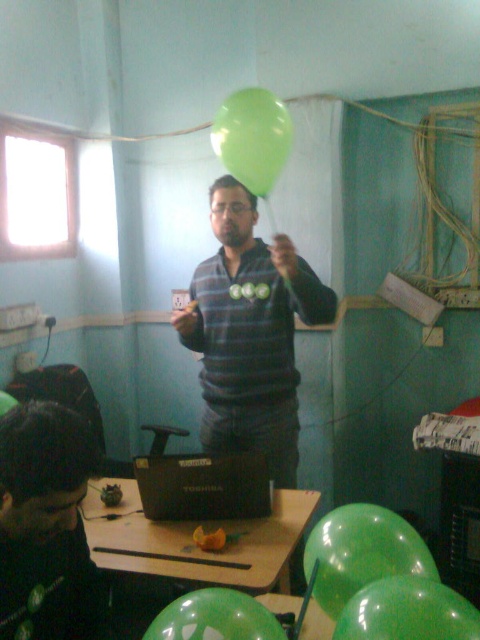
Question: Is matte black laptop at center thinner than green rubber balloon at center?

Choices:
 (A) no
 (B) yes

Answer: (A)

Question: Which point appears farthest from the camera in this image?

Choices:
 (A) (362, 541)
 (B) (193, 342)

Answer: (B)

Question: Which point is farther from the camera taking this photo?

Choices:
 (A) (256, 161)
 (B) (71, 614)
 (C) (282, 454)
 (D) (343, 627)

Answer: (C)

Question: Can you confirm if matte black laptop at lower left is positioned to the right of green rubber balloon at upper center?

Choices:
 (A) yes
 (B) no

Answer: (B)

Question: Can you confirm if matte green sweater at center is wider than green rubber balloon at center?

Choices:
 (A) no
 (B) yes

Answer: (B)

Question: Which of these objects is positioned farthest from the green rubber balloon at upper center?

Choices:
 (A) green matte balloon at center
 (B) matte black laptop at lower left

Answer: (A)